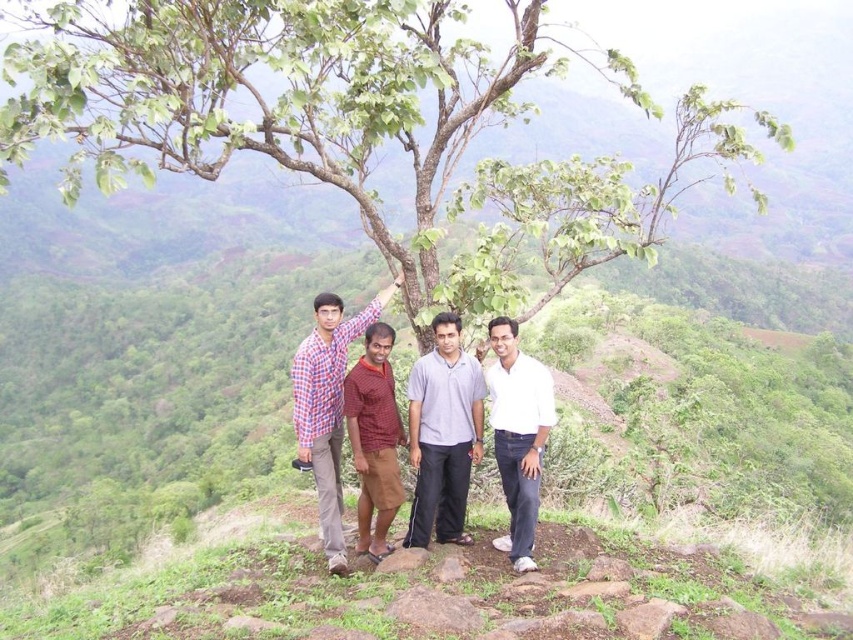
Question: Does light gray cotton shirt at center have a smaller size compared to maroon cotton shirt at center?

Choices:
 (A) yes
 (B) no

Answer: (A)

Question: Is green leafy tree at center wider than checkered fabric shirt at center?

Choices:
 (A) no
 (B) yes

Answer: (B)

Question: Which point appears closest to the camera in this image?

Choices:
 (A) (465, 387)
 (B) (225, 60)
 (C) (325, 348)

Answer: (B)

Question: Is green leafy tree at center to the right of white cotton shirt at center from the viewer's perspective?

Choices:
 (A) yes
 (B) no

Answer: (A)

Question: Which point is farther to the camera?

Choices:
 (A) (428, 400)
 (B) (323, 499)
 (C) (512, 346)
 (D) (361, 508)

Answer: (D)

Question: Which point is farther to the camera?

Choices:
 (A) light gray cotton shirt at center
 (B) checkered fabric shirt at center

Answer: (A)